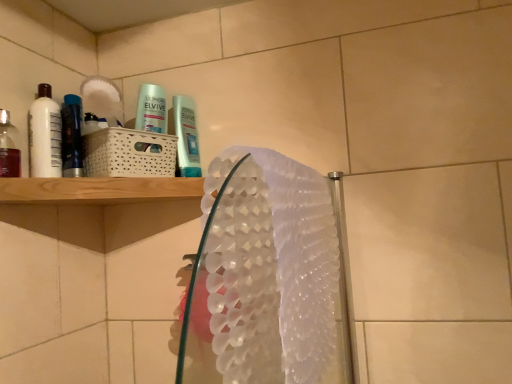
Question: Considering the relative sizes of white glossy mouthwash at left, the second mouthwash from the back, and translucent plastic mouthwash at left, which is counted as the 1th mouthwash, starting from the front, in the image provided, is white glossy mouthwash at left, the second mouthwash from the back, shorter than translucent plastic mouthwash at left, which is counted as the 1th mouthwash, starting from the front,?

Choices:
 (A) no
 (B) yes

Answer: (A)

Question: Is white glossy mouthwash at left, the second mouthwash from the front, wider than translucent plastic mouthwash at left, which appears as the third mouthwash when viewed from the back?

Choices:
 (A) no
 (B) yes

Answer: (A)

Question: Is white glossy mouthwash at left, the second mouthwash from the back, not inside translucent plastic mouthwash at left, which appears as the third mouthwash when viewed from the back?

Choices:
 (A) yes
 (B) no

Answer: (A)

Question: Are white glossy mouthwash at left, the second mouthwash from the back, and translucent plastic mouthwash at left, which appears as the third mouthwash when viewed from the back, making contact?

Choices:
 (A) yes
 (B) no

Answer: (A)

Question: From the image's perspective, is white glossy mouthwash at left, the second mouthwash from the front, on translucent plastic mouthwash at left, which is counted as the 1th mouthwash, starting from the front?

Choices:
 (A) yes
 (B) no

Answer: (A)

Question: From a real-world perspective, is white glossy mouthwash at left, the second mouthwash from the back, physically above translucent plastic mouthwash at left, which appears as the third mouthwash when viewed from the back?

Choices:
 (A) yes
 (B) no

Answer: (A)

Question: Is metallic blue mouthwash at left, which is the first mouthwash from back to front, far from translucent plastic mouthwash at left, which appears as the third mouthwash when viewed from the back?

Choices:
 (A) yes
 (B) no

Answer: (B)

Question: From a real-world perspective, is metallic blue mouthwash at left, which is the first mouthwash from back to front, under translucent plastic mouthwash at left, which appears as the third mouthwash when viewed from the back?

Choices:
 (A) yes
 (B) no

Answer: (B)

Question: Considering the relative sizes of metallic blue mouthwash at left, acting as the third mouthwash starting from the front, and translucent plastic mouthwash at left, which is counted as the 1th mouthwash, starting from the front, in the image provided, is metallic blue mouthwash at left, acting as the third mouthwash starting from the front, thinner than translucent plastic mouthwash at left, which is counted as the 1th mouthwash, starting from the front,?

Choices:
 (A) yes
 (B) no

Answer: (B)

Question: From the image's perspective, would you say metallic blue mouthwash at left, which is the first mouthwash from back to front, is shown under translucent plastic mouthwash at left, which appears as the third mouthwash when viewed from the back?

Choices:
 (A) no
 (B) yes

Answer: (A)

Question: Is metallic blue mouthwash at left, which is the first mouthwash from back to front, in contact with translucent plastic mouthwash at left, which appears as the third mouthwash when viewed from the back?

Choices:
 (A) yes
 (B) no

Answer: (B)

Question: Does metallic blue mouthwash at left, acting as the third mouthwash starting from the front, have a larger size compared to translucent plastic mouthwash at left, which is counted as the 1th mouthwash, starting from the front?

Choices:
 (A) yes
 (B) no

Answer: (A)

Question: Is white textured hand towel at center thinner than translucent plastic mouthwash at left, which is counted as the 1th mouthwash, starting from the front?

Choices:
 (A) yes
 (B) no

Answer: (B)